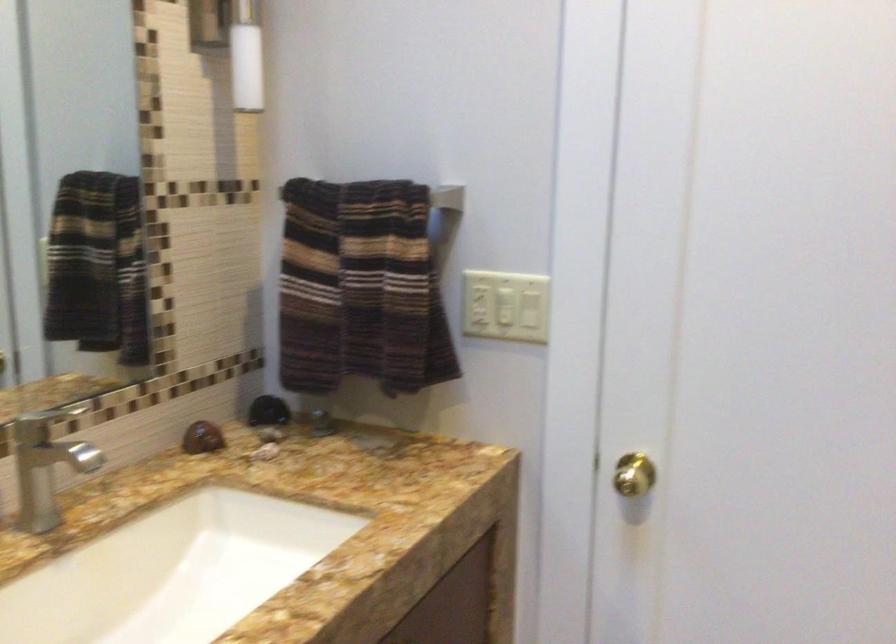
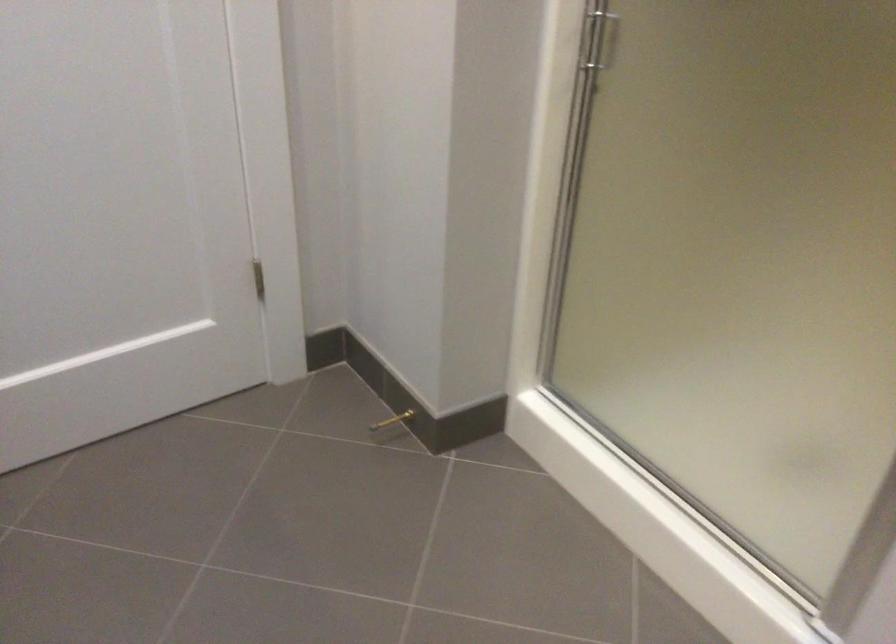
First-person continuous shooting, in which direction is the camera rotating?

The rotation direction of the camera is right-down.